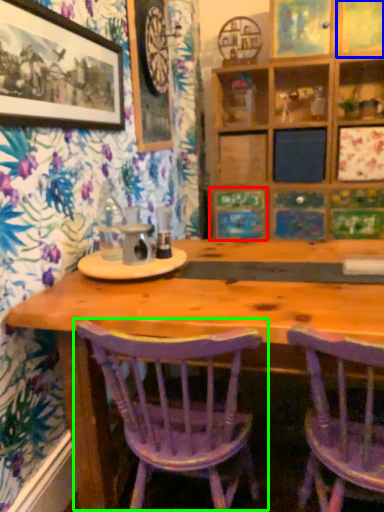
Question: Based on their relative distances, which object is nearer to decorative picture (highlighted by a red box)? Choose from picture frame (highlighted by a blue box) and chair (highlighted by a green box).

Choices:
 (A) picture frame
 (B) chair

Answer: (A)